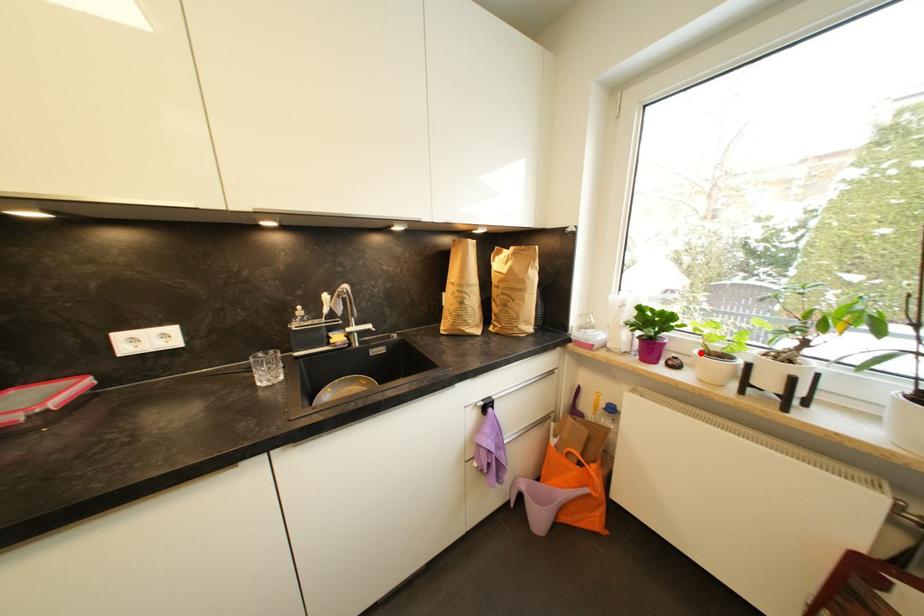
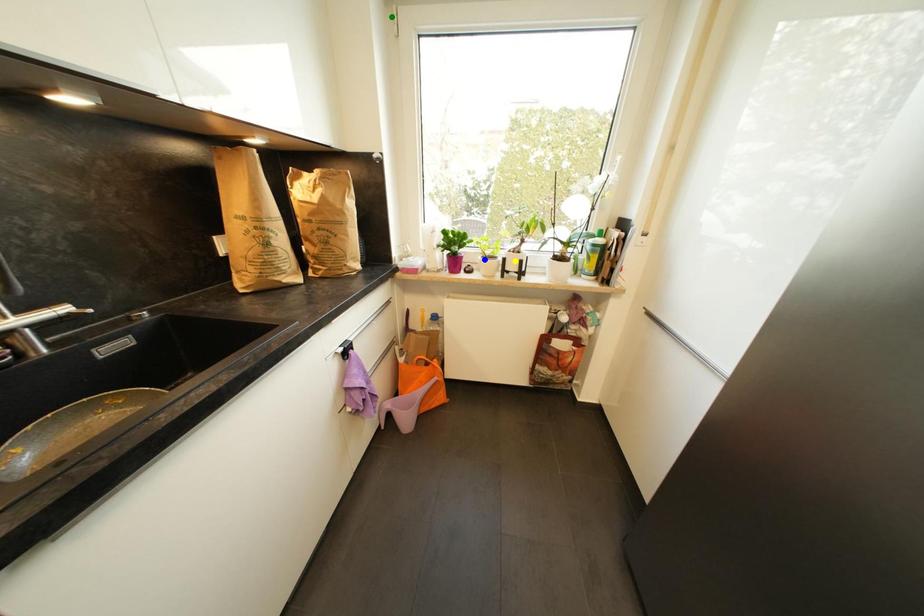
Question: I am providing you with two images of the same scene from different viewpoints. A red point is marked on the first image. You are given multiple points on the second image. In image 2, which mark is for the same physical point as the one in image 1?

Choices:
 (A) yellow point
 (B) green point
 (C) blue point

Answer: (C)